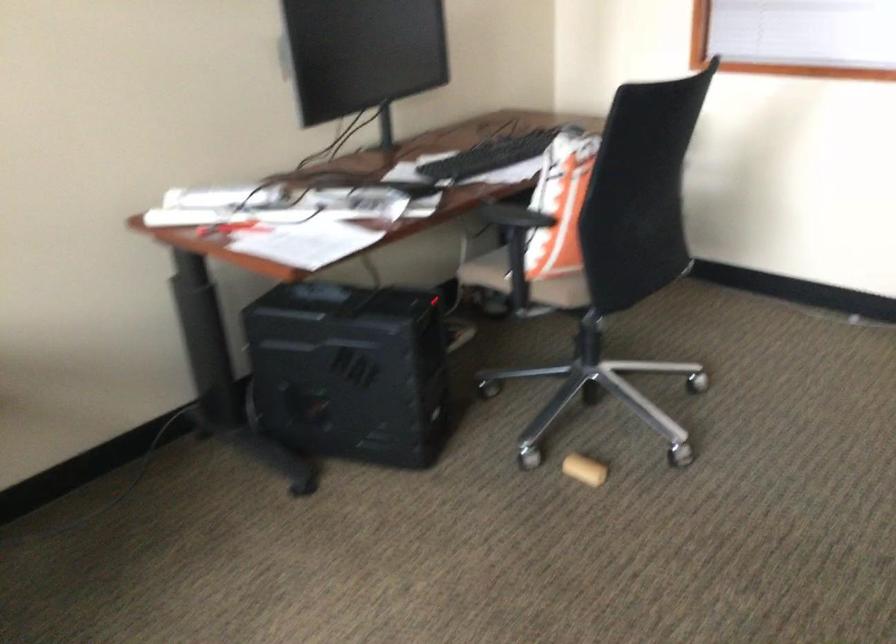
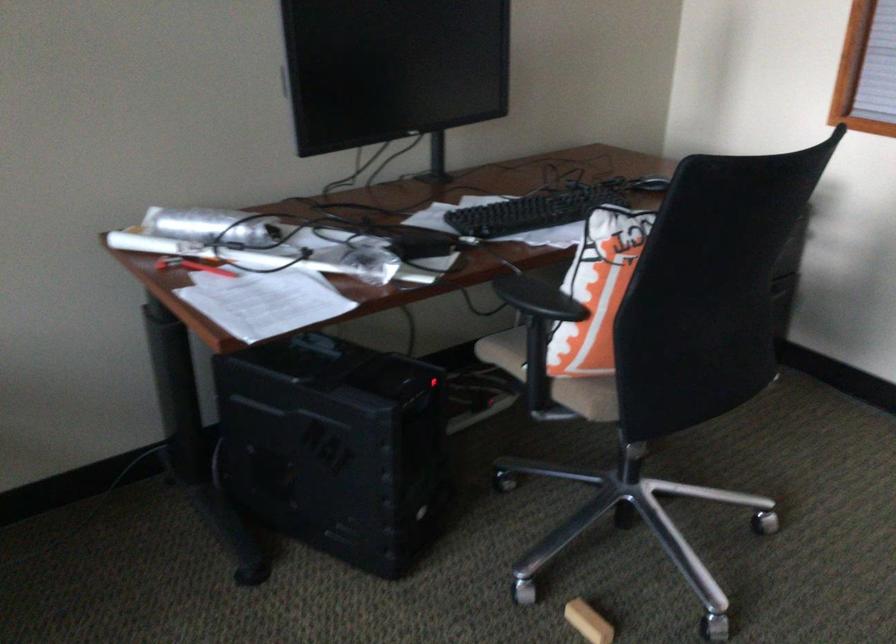
Find the pixel in the second image that matches point 486,158 in the first image.

(532, 211)